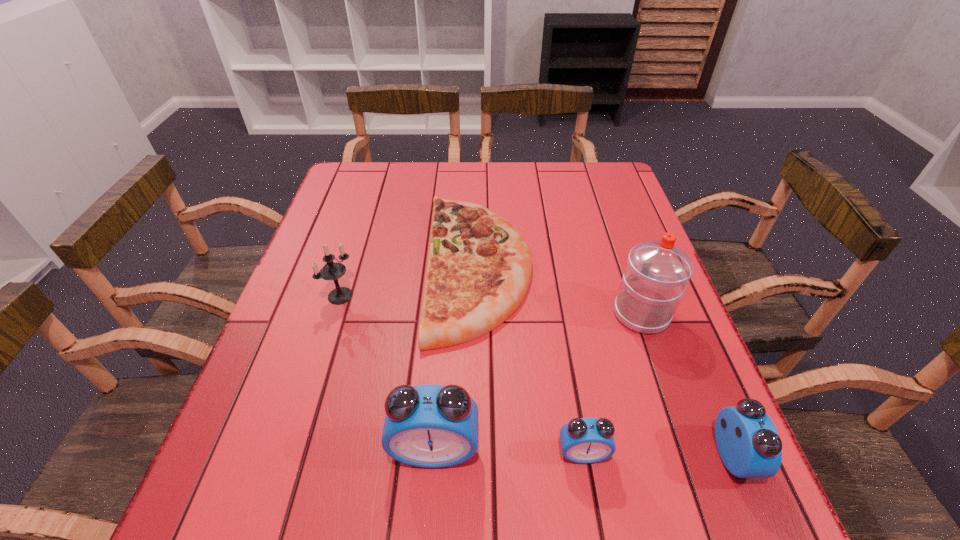
What are the coordinates of `free space located 0.360m on the handle side of the tallest object` in the screenshot? It's located at (604, 206).

The image size is (960, 540). Find the location of `vacant region located 0.260m on the handle side of the tallest object`. vacant region located 0.260m on the handle side of the tallest object is located at coordinates (611, 226).

At what (x,y) coordinates should I click in order to perform the action: click on vacant space positioned on the handle side of the tallest object. Please return your answer as a coordinate pair (x, y). Looking at the image, I should click on (621, 255).

This screenshot has height=540, width=960. I want to click on object located in the left edge section of the desktop, so click(x=332, y=270).

The width and height of the screenshot is (960, 540). I want to click on alarm clock that is at the right edge, so click(747, 440).

Where is `water bottle that is at the right edge`? This screenshot has height=540, width=960. water bottle that is at the right edge is located at coordinates 657,271.

Image resolution: width=960 pixels, height=540 pixels. Find the location of `object that is at the near right corner`. object that is at the near right corner is located at coordinates (747, 440).

In the image, there is a desktop. At what (x,y) coordinates should I click in order to perform the action: click on vacant space at the far edge. Please return your answer as a coordinate pair (x, y). Looking at the image, I should click on (453, 178).

The height and width of the screenshot is (540, 960). In the image, there is a desktop. Identify the location of free region at the near edge. (342, 434).

Where is `vacant space at the left edge`? This screenshot has height=540, width=960. vacant space at the left edge is located at coordinates (360, 293).